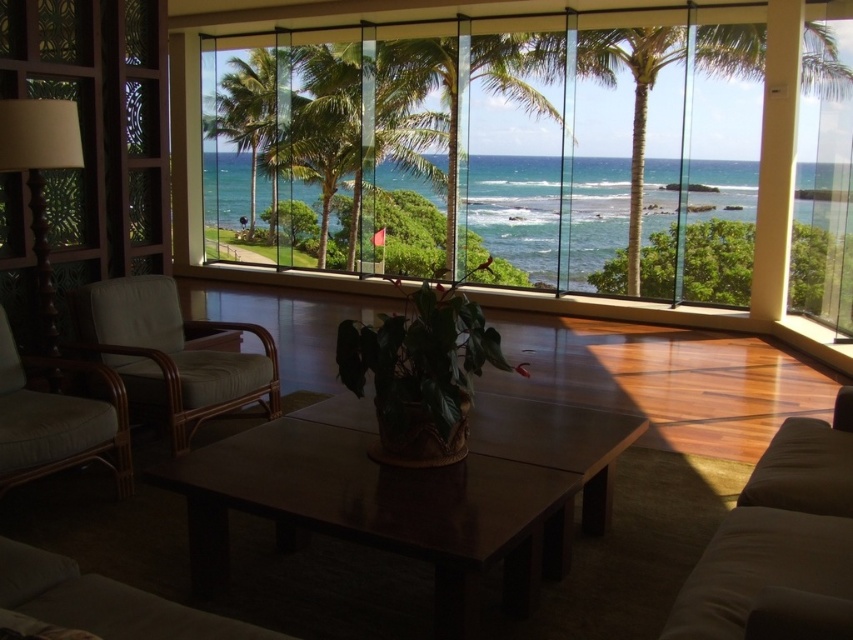
Can you confirm if white fabric couch at lower left is taller than green leafy palm tree at right?

No.

From the picture: Who is more distant from viewer, (15, 564) or (619, 45)?

Point (619, 45)

Where is `white fabric couch at lower left`? The image size is (853, 640). white fabric couch at lower left is located at coordinates (103, 602).

Can you confirm if light brown woven armchair at left is taller than green leafy palm tree at right?

In fact, light brown woven armchair at left may be shorter than green leafy palm tree at right.

Is light brown woven armchair at left below green leafy palm tree at right?

Yes.

At what (x,y) coordinates should I click in order to perform the action: click on light brown woven armchair at left. Please return your answer as a coordinate pair (x, y). The width and height of the screenshot is (853, 640). Looking at the image, I should click on (57, 420).

At what (x,y) coordinates should I click in order to perform the action: click on light brown woven armchair at left. Please return your answer as a coordinate pair (x, y). Looking at the image, I should click on (57, 420).

Is brown fabric couch at lower right wider than green leafy palm tree at right?

No, brown fabric couch at lower right is not wider than green leafy palm tree at right.

Which is in front, point (808, 570) or point (637, 156)?

Point (808, 570)

This screenshot has width=853, height=640. Describe the element at coordinates (780, 545) in the screenshot. I see `brown fabric couch at lower right` at that location.

Where is `brown fabric couch at lower right`? brown fabric couch at lower right is located at coordinates (780, 545).